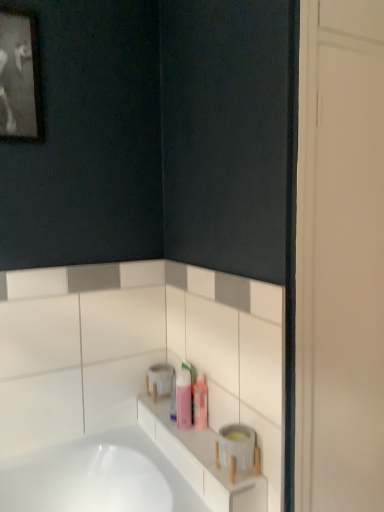
Find the location of a particular element. Image resolution: width=384 pixels, height=512 pixels. vacant area that is in front of pink plastic bottle at center is located at coordinates (193, 439).